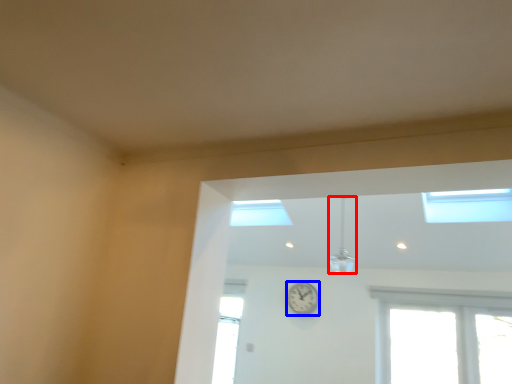
Question: Which object appears farthest to the camera in this image, light fixture (highlighted by a red box) or clock (highlighted by a blue box)?

Choices:
 (A) light fixture
 (B) clock

Answer: (B)